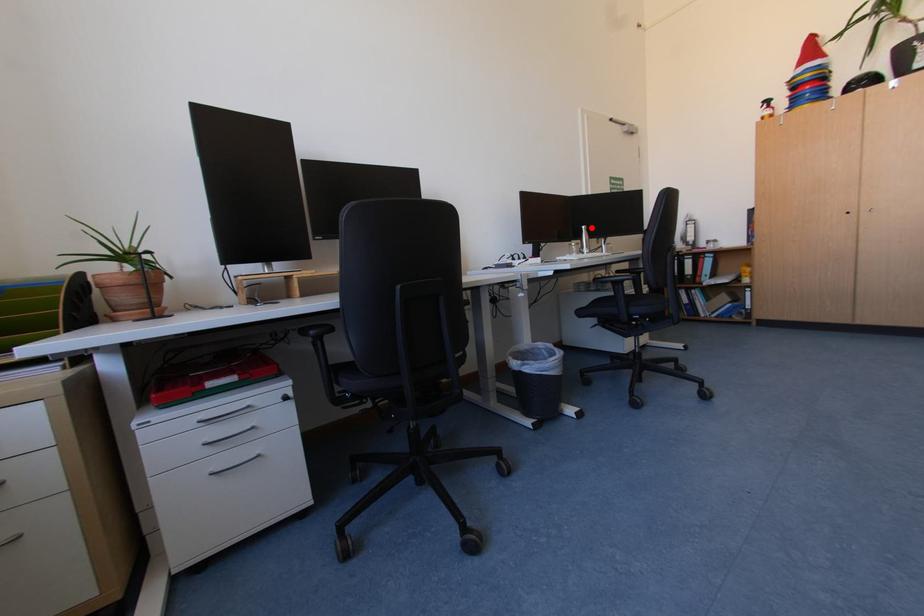
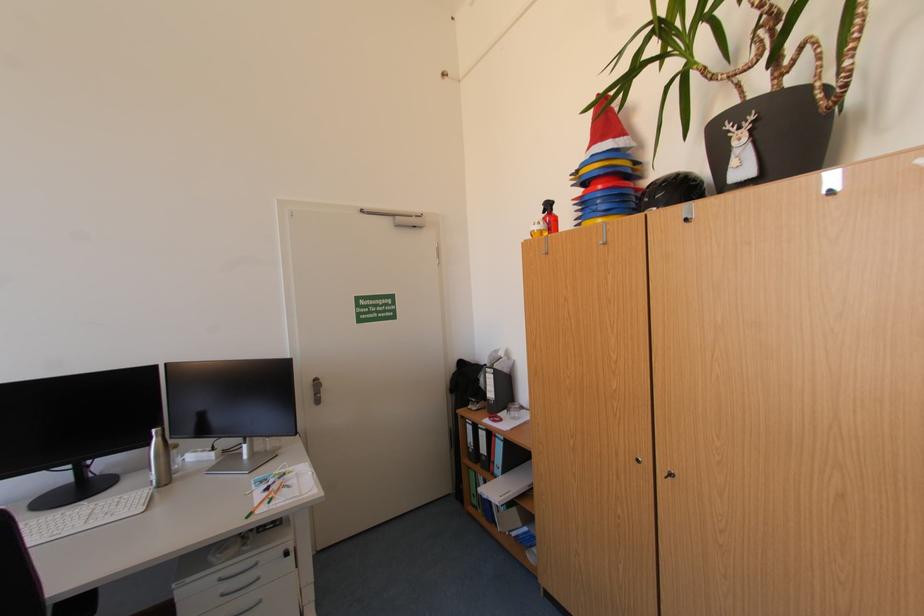
In the second image, find the point that corresponds to the highlighted location in the first image.

(161, 431)